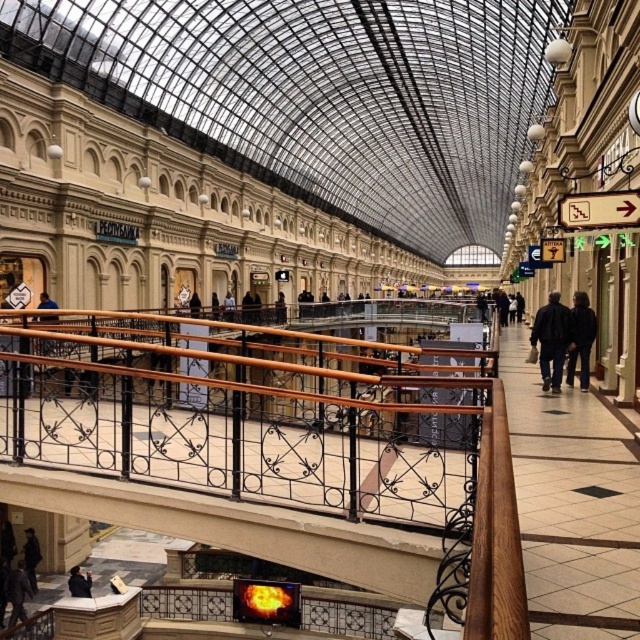
Question: Does dark gray jacket at lower left have a greater width compared to matte black jacket at lower left?

Choices:
 (A) no
 (B) yes

Answer: (A)

Question: Observing the image, what is the correct spatial positioning of dark blue jacket at lower left in reference to dark gray jacket at lower left?

Choices:
 (A) above
 (B) below

Answer: (A)

Question: Where is dark gray jacket at lower left located in relation to matte black jacket at lower left in the image?

Choices:
 (A) above
 (B) below

Answer: (B)

Question: Which point is closer to the camera taking this photo?

Choices:
 (A) (51, 301)
 (B) (19, 573)
 (C) (33, 584)

Answer: (B)

Question: Among these points, which one is nearest to the camera?

Choices:
 (A) (22, 557)
 (B) (10, 598)

Answer: (B)

Question: Which point is closer to the camera?

Choices:
 (A) (561, 337)
 (B) (72, 572)

Answer: (A)